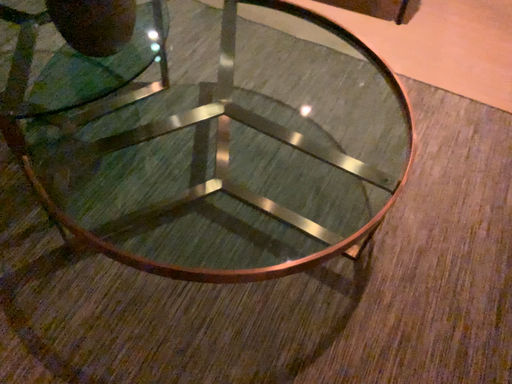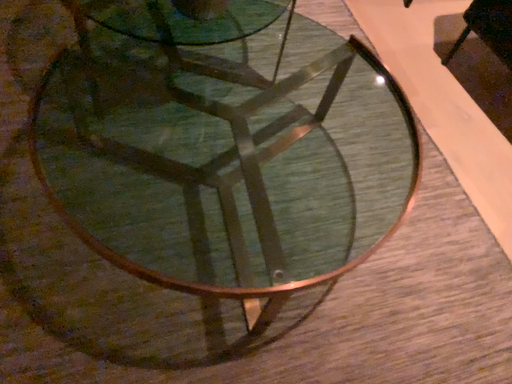
Question: Which way did the camera rotate in the video?

Choices:
 (A) rotated downward
 (B) rotated upward

Answer: (B)